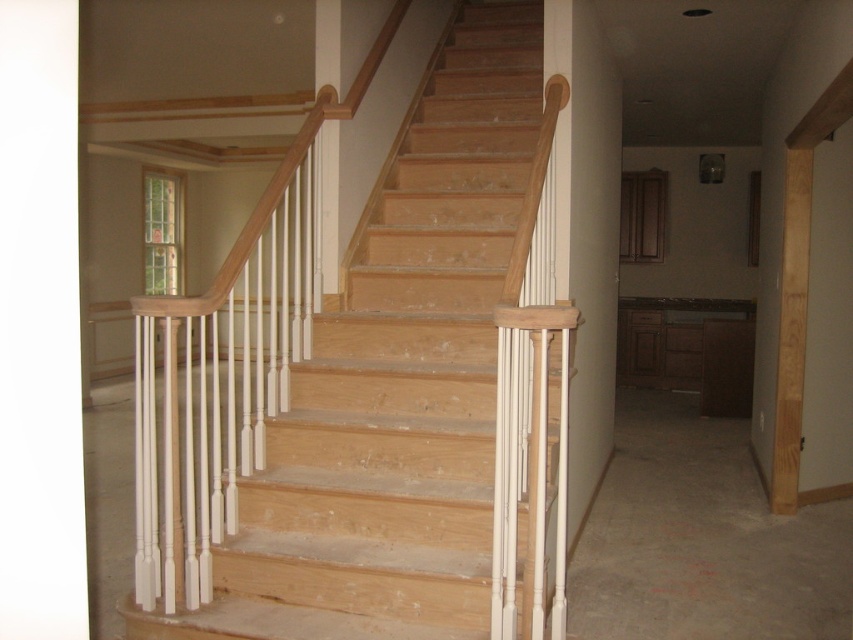
The width and height of the screenshot is (853, 640). What are the coordinates of `natural wood stairs at center` in the screenshot? It's located at (367, 390).

Is natural wood stairs at center to the left of white wood pillar at center from the viewer's perspective?

In fact, natural wood stairs at center is to the right of white wood pillar at center.

Measure the distance between natural wood stairs at center and camera.

The distance of natural wood stairs at center from camera is 7.68 feet.

Find the location of a particular element. natural wood stairs at center is located at coordinates (367, 390).

Between natural wood stairs at center and white painted wood pillar at center, which one has less height?

white painted wood pillar at center is shorter.

Describe the element at coordinates (367, 390) in the screenshot. I see `natural wood stairs at center` at that location.

Is point (474, 316) positioned after point (601, 296)?

No, (474, 316) is closer to viewer.

Image resolution: width=853 pixels, height=640 pixels. I want to click on natural wood stairs at center, so click(x=367, y=390).

Can you confirm if white painted wood pillar at center is positioned below white wood pillar at center?

Yes.

Can you confirm if white painted wood pillar at center is thinner than white wood pillar at center?

A: No, white painted wood pillar at center is not thinner than white wood pillar at center.

Which is in front, point (585, 269) or point (323, 209)?

Point (323, 209)

Where is `white painted wood pillar at center`? white painted wood pillar at center is located at coordinates (585, 234).